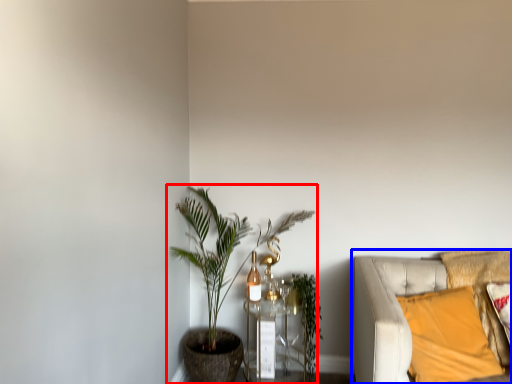
Question: Which object appears closest to the camera in this image, houseplant (highlighted by a red box) or studio couch (highlighted by a blue box)?

Choices:
 (A) houseplant
 (B) studio couch

Answer: (B)